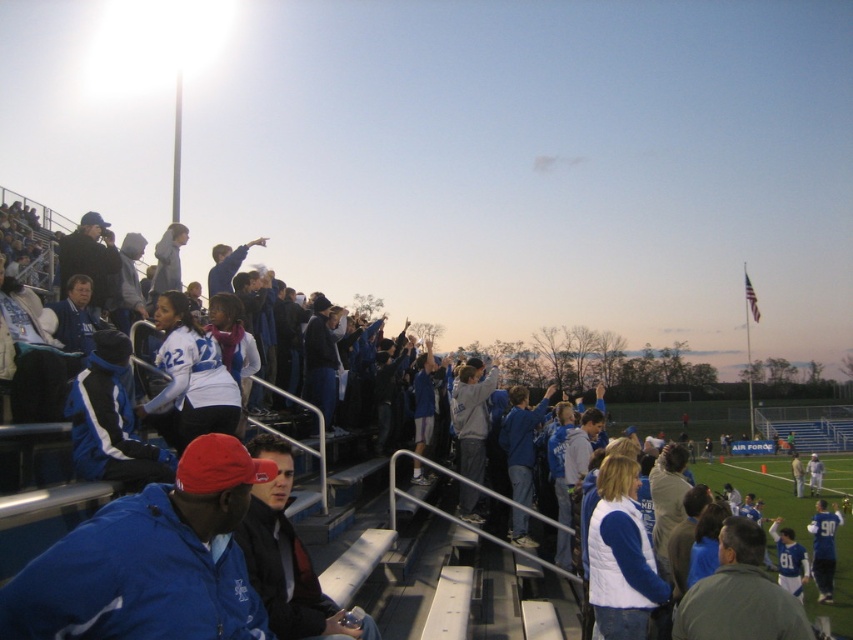
Does blue matte jacket at lower left have a greater height compared to blue fabric jacket at center?

Incorrect, blue matte jacket at lower left's height is not larger of blue fabric jacket at center's.

Who is more forward, (41, 579) or (4, 481)?

Positioned in front is point (41, 579).

This screenshot has width=853, height=640. In order to click on blue matte jacket at lower left in this screenshot , I will do `click(149, 561)`.